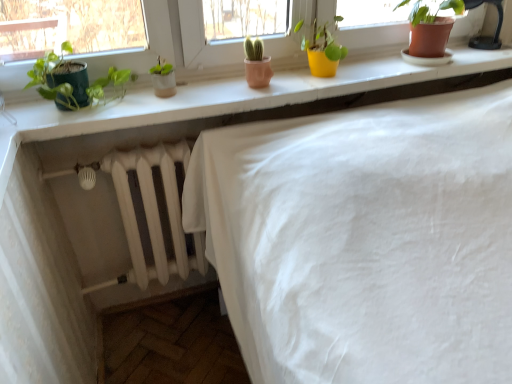
Question: From a real-world perspective, is green matte pot at left, the 1th houseplant in the left-to-right sequence, positioned over yellow matte pot at upper center, which is counted as the 2th houseplant, starting from the left, based on gravity?

Choices:
 (A) no
 (B) yes

Answer: (B)

Question: Is green matte pot at left, acting as the 3th houseplant starting from the right, beside yellow matte pot at upper center, which is the second houseplant in right-to-left order?

Choices:
 (A) no
 (B) yes

Answer: (A)

Question: Can you confirm if green matte pot at left, acting as the 3th houseplant starting from the right, is shorter than yellow matte pot at upper center, which is counted as the 2th houseplant, starting from the left?

Choices:
 (A) no
 (B) yes

Answer: (B)

Question: Is the depth of green matte pot at left, acting as the 3th houseplant starting from the right, greater than that of yellow matte pot at upper center, which is the second houseplant in right-to-left order?

Choices:
 (A) no
 (B) yes

Answer: (A)

Question: Is green matte pot at left, acting as the 3th houseplant starting from the right, facing away from yellow matte pot at upper center, which is the second houseplant in right-to-left order?

Choices:
 (A) no
 (B) yes

Answer: (A)

Question: In terms of height, does terracotta clay pot at upper right, which is the first houseplant in right-to-left order, look taller or shorter compared to yellow matte pot at upper center, which is counted as the 2th houseplant, starting from the left?

Choices:
 (A) short
 (B) tall

Answer: (B)

Question: Relative to yellow matte pot at upper center, which is counted as the 2th houseplant, starting from the left, is terracotta clay pot at upper right, arranged as the 3th houseplant when viewed from the left, in front or behind?

Choices:
 (A) behind
 (B) front

Answer: (A)

Question: From a real-world perspective, relative to yellow matte pot at upper center, which is counted as the 2th houseplant, starting from the left, is terracotta clay pot at upper right, which is the first houseplant in right-to-left order, vertically above or below?

Choices:
 (A) above
 (B) below

Answer: (A)

Question: Based on their positions, is terracotta clay pot at upper right, which is the first houseplant in right-to-left order, located to the left or right of yellow matte pot at upper center, which is counted as the 2th houseplant, starting from the left?

Choices:
 (A) right
 (B) left

Answer: (A)

Question: In the image, is green matte pot at left, the 1th houseplant in the left-to-right sequence, on the left side or the right side of terracotta clay pot at upper right, arranged as the 3th houseplant when viewed from the left?

Choices:
 (A) right
 (B) left

Answer: (B)

Question: In terms of width, does green matte pot at left, the 1th houseplant in the left-to-right sequence, look wider or thinner when compared to terracotta clay pot at upper right, arranged as the 3th houseplant when viewed from the left?

Choices:
 (A) thin
 (B) wide

Answer: (A)

Question: Considering the positions of green matte pot at left, acting as the 3th houseplant starting from the right, and terracotta clay pot at upper right, arranged as the 3th houseplant when viewed from the left, in the image, is green matte pot at left, acting as the 3th houseplant starting from the right, taller or shorter than terracotta clay pot at upper right, arranged as the 3th houseplant when viewed from the left,?

Choices:
 (A) tall
 (B) short

Answer: (B)

Question: Is green matte pot at left, acting as the 3th houseplant starting from the right, situated inside terracotta clay pot at upper right, arranged as the 3th houseplant when viewed from the left, or outside?

Choices:
 (A) inside
 (B) outside

Answer: (B)

Question: From a real-world perspective, is green matte pot at left, acting as the 3th houseplant starting from the right, above or below matte white windowsill at upper center?

Choices:
 (A) below
 (B) above

Answer: (B)

Question: In terms of size, does green matte pot at left, the 1th houseplant in the left-to-right sequence, appear bigger or smaller than matte white windowsill at upper center?

Choices:
 (A) small
 (B) big

Answer: (A)